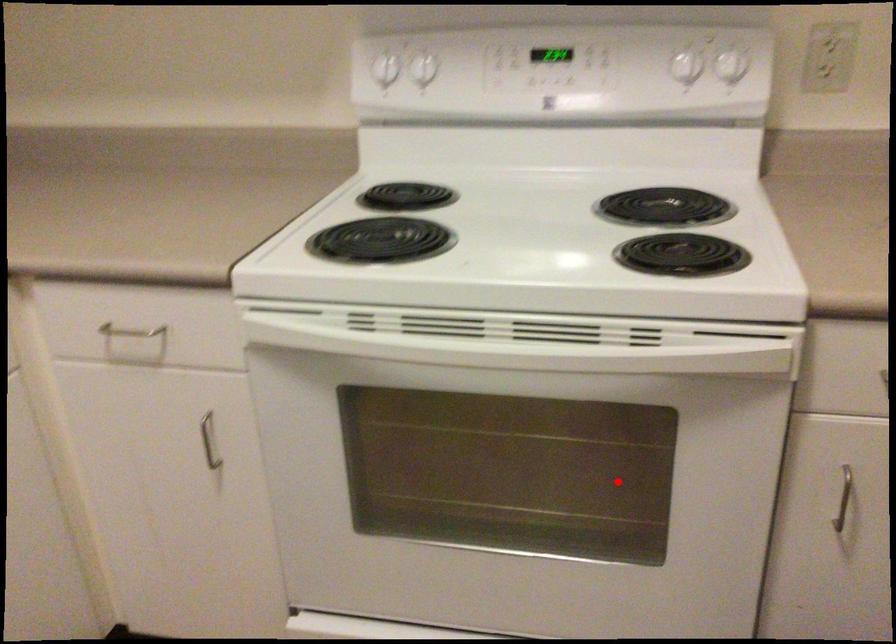
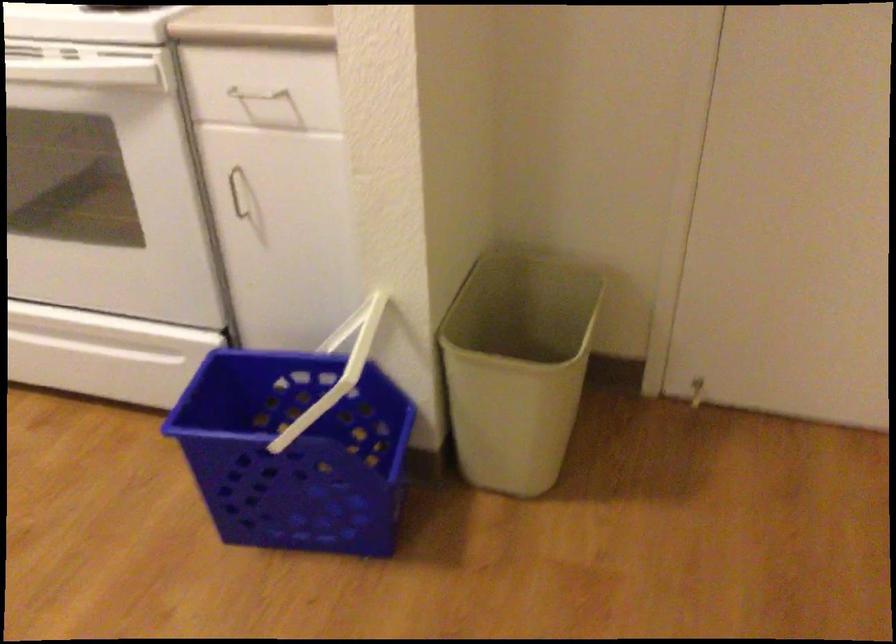
In the second image, find the point that corresponds to the highlighted location in the first image.

(104, 185)